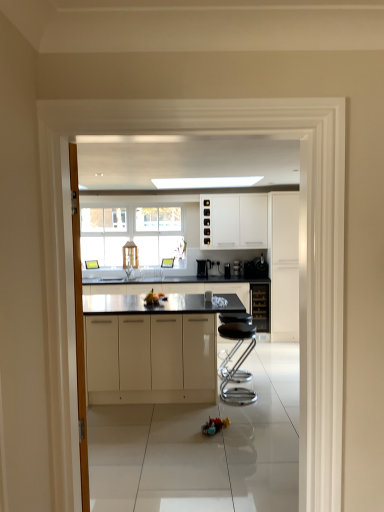
Question: Can you confirm if white glossy cabinet at right, which is the 4th cabinetry from left to right, is wider than satin black coffee machine at center?

Choices:
 (A) no
 (B) yes

Answer: (B)

Question: Is white glossy cabinet at right, the 3th cabinetry when ordered from back to front, positioned with its back to satin black coffee machine at center?

Choices:
 (A) yes
 (B) no

Answer: (B)

Question: Is white glossy cabinet at right, the 3th cabinetry when ordered from back to front, further to the viewer compared to satin black coffee machine at center?

Choices:
 (A) no
 (B) yes

Answer: (A)

Question: Is white glossy cabinet at right, which is the second cabinetry from front to back, positioned before satin black coffee machine at center?

Choices:
 (A) yes
 (B) no

Answer: (A)

Question: Is white glossy cabinet at right, the 3th cabinetry when ordered from back to front, positioned far away from satin black coffee machine at center?

Choices:
 (A) no
 (B) yes

Answer: (A)

Question: Is white glossy cabinet at right, which is the 4th cabinetry from left to right, shorter than satin black coffee machine at center?

Choices:
 (A) yes
 (B) no

Answer: (B)

Question: Considering the relative positions of satin black coffee machine at center and glossy white cabinets at center, the 1th cabinetry in the left-to-right sequence, in the image provided, is satin black coffee machine at center to the right of glossy white cabinets at center, the 1th cabinetry in the left-to-right sequence, from the viewer's perspective?

Choices:
 (A) no
 (B) yes

Answer: (B)

Question: From the image's perspective, does satin black coffee machine at center appear higher than glossy white cabinets at center, the 1th cabinetry in the left-to-right sequence?

Choices:
 (A) no
 (B) yes

Answer: (B)

Question: Is satin black coffee machine at center outside glossy white cabinets at center, the 4th cabinetry when ordered from right to left?

Choices:
 (A) no
 (B) yes

Answer: (B)

Question: From a real-world perspective, is satin black coffee machine at center positioned under glossy white cabinets at center, positioned as the 4th cabinetry in back-to-front order, based on gravity?

Choices:
 (A) yes
 (B) no

Answer: (B)

Question: From a real-world perspective, is satin black coffee machine at center on glossy white cabinets at center, positioned as the 4th cabinetry in back-to-front order?

Choices:
 (A) no
 (B) yes

Answer: (B)

Question: Is satin black coffee machine at center facing towards glossy white cabinets at center, placed as the 1th cabinetry when sorted from front to back?

Choices:
 (A) yes
 (B) no

Answer: (B)

Question: Considering the relative positions of black glass wine cooler at center, arranged as the 3th cabinetry when viewed from the left, and white glossy cabinets at upper center, which appears as the 3th cabinetry when viewed from the right, in the image provided, is black glass wine cooler at center, arranged as the 3th cabinetry when viewed from the left, to the left of white glossy cabinets at upper center, which appears as the 3th cabinetry when viewed from the right, from the viewer's perspective?

Choices:
 (A) yes
 (B) no

Answer: (B)